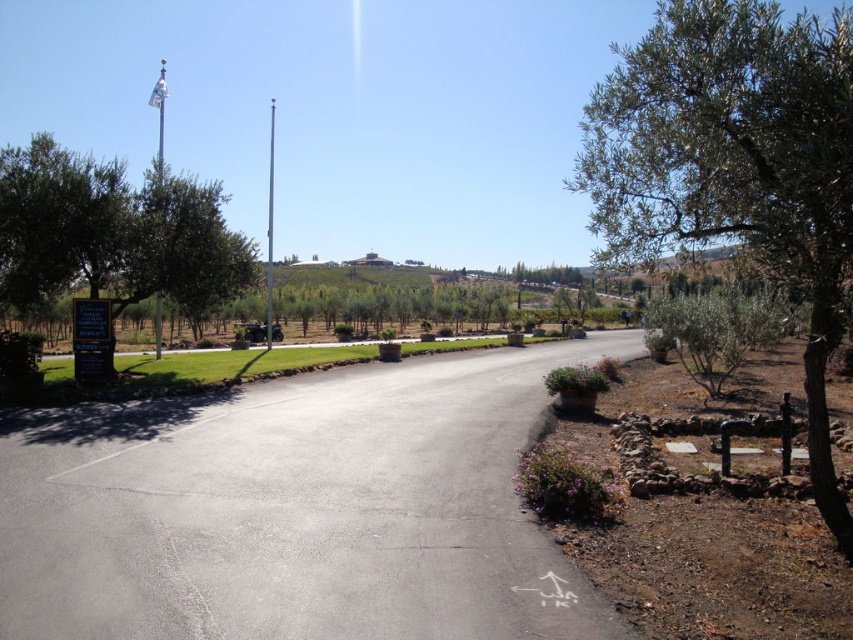
Is asphalt at center wider than green leafy olive tree at right?

No, asphalt at center is not wider than green leafy olive tree at right.

Is asphalt at center bigger than green leafy olive tree at right?

Actually, asphalt at center might be smaller than green leafy olive tree at right.

Which is behind, point (178, 500) or point (808, 129)?

The point (178, 500) is behind.

The image size is (853, 640). Find the location of `asphalt at center`. asphalt at center is located at coordinates (294, 509).

Between green leafy olive tree at right and green leafy tree at left, which one is positioned higher?

green leafy olive tree at right is above.

Who is lower down, green leafy olive tree at right or green leafy tree at left?

green leafy tree at left is lower down.

Which is in front, point (830, 51) or point (96, 257)?

Point (830, 51) is in front.

Identify the location of green leafy olive tree at right. The height and width of the screenshot is (640, 853). (735, 163).

Which of these two, asphalt at center or green leafy tree at left, stands taller?

With more height is green leafy tree at left.

Is point (355, 500) positioned in front of point (100, 216)?

Yes, point (355, 500) is in front of point (100, 216).

Image resolution: width=853 pixels, height=640 pixels. Find the location of `asphalt at center`. asphalt at center is located at coordinates (294, 509).

At what (x,y) coordinates should I click in order to perform the action: click on asphalt at center. Please return your answer as a coordinate pair (x, y). Looking at the image, I should click on (294, 509).